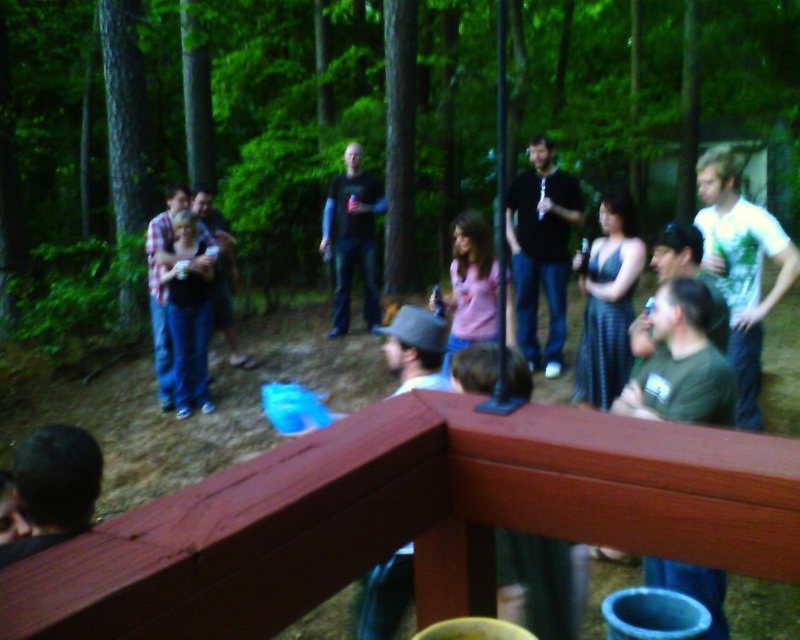
Question: Which of these objects is positioned farthest from the black zip-up hoodie at center?

Choices:
 (A) dark brown hair at lower left
 (B) dark gray shirt at center

Answer: (A)

Question: Does white printed t-shirt at right lie in front of dark gray shirt at center?

Choices:
 (A) yes
 (B) no

Answer: (A)

Question: Among these points, which one is nearest to the camera?

Choices:
 (A) (180, 200)
 (B) (330, 234)
 (C) (745, 202)

Answer: (C)

Question: Which object is farther from the camera taking this photo?

Choices:
 (A) bearded man at center
 (B) dark brown hair at lower left
 (C) black zip-up hoodie at center
 (D) white printed t-shirt at right

Answer: (A)

Question: Observing the image, what is the correct spatial positioning of dark gray shirt at center in reference to plaid shirt at left?

Choices:
 (A) right
 (B) left

Answer: (A)

Question: Does dark gray shirt at center appear over plaid shirt at left?

Choices:
 (A) yes
 (B) no

Answer: (A)